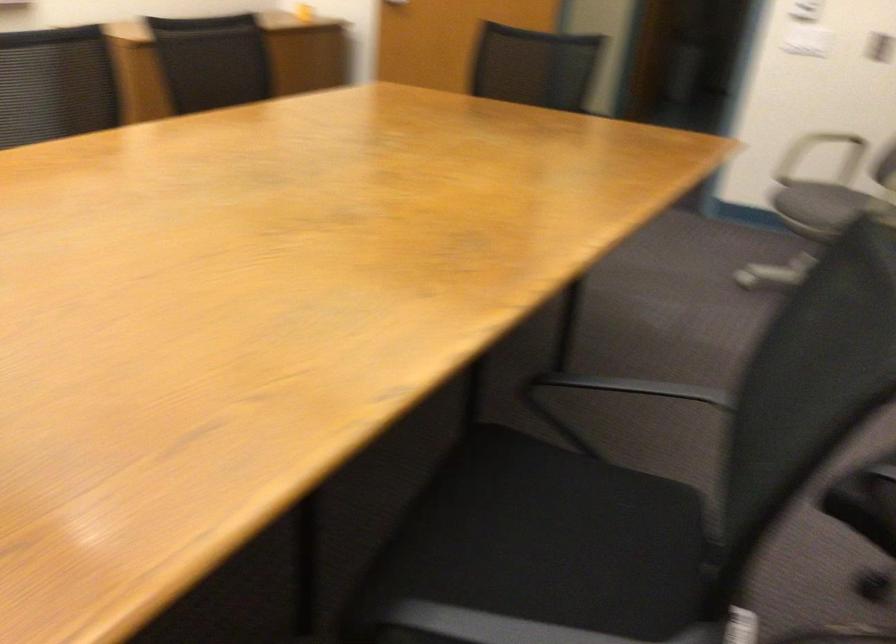
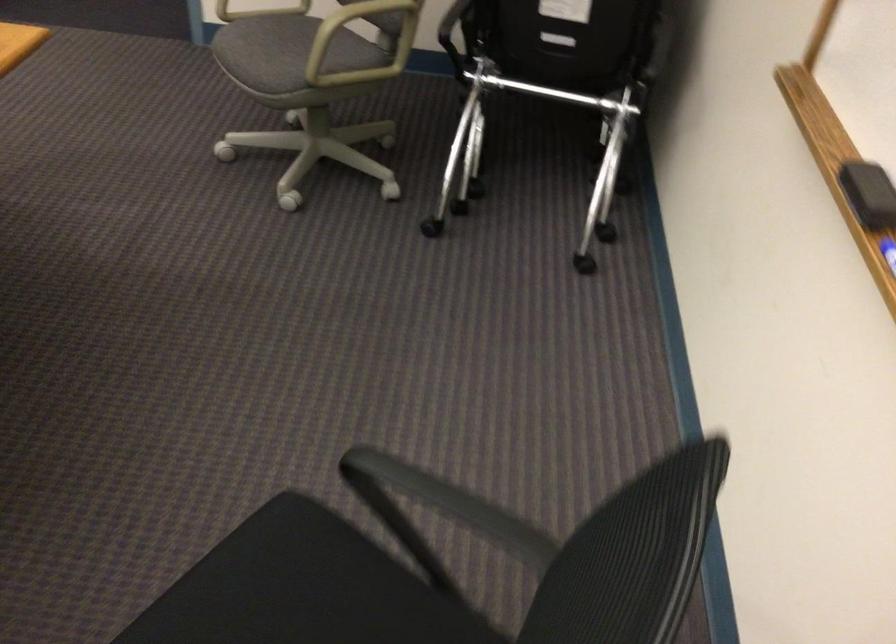
Where in the second image is the point corresponding to the point at 823,190 from the first image?

(286, 42)